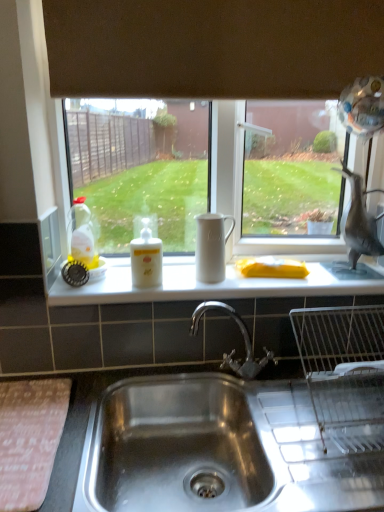
Identify the location of blank space situated above white matte counter top at center (from a real-world perspective). (244, 278).